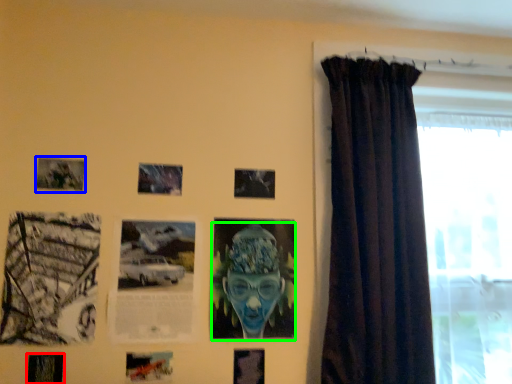
Question: Considering the real-world distances, which object is farthest from picture frame (highlighted by a red box)? picture frame (highlighted by a blue box) or person (highlighted by a green box)?

Choices:
 (A) picture frame
 (B) person

Answer: (B)